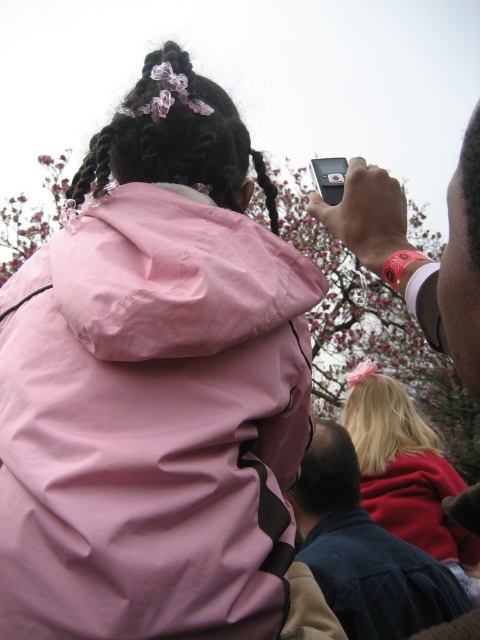
You are a photographer trying to capture a shot of the matte pink hoodie at upper right and the pink fabric braids at upper center. Based on their positions, which object would appear larger in your photo?

The matte pink hoodie at upper right appears larger in the photo because it is much taller than the pink fabric braids at upper center.